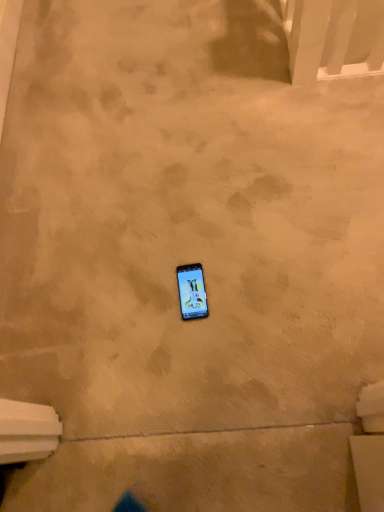
Where is `free space to the left of matte black phone at center`? The height and width of the screenshot is (512, 384). free space to the left of matte black phone at center is located at coordinates (137, 306).